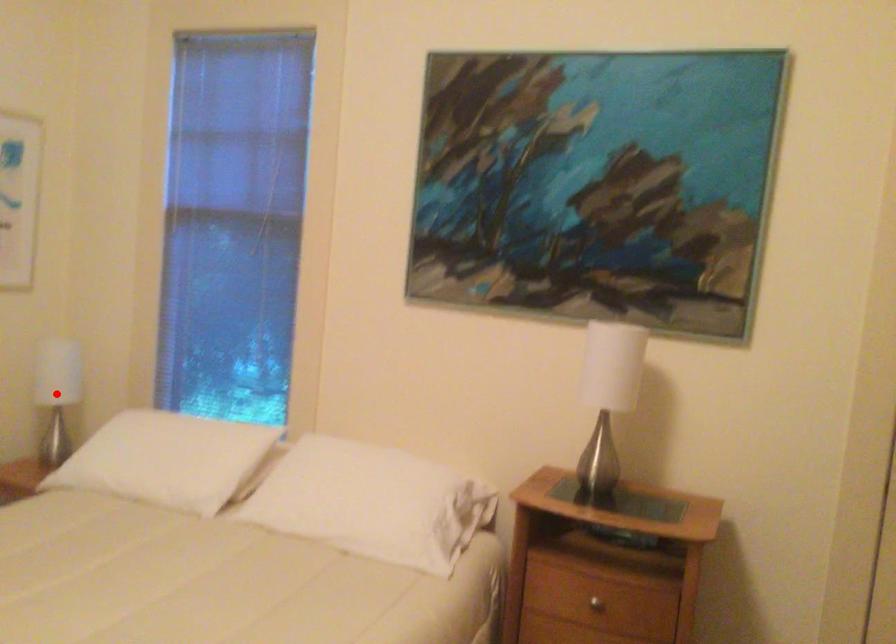
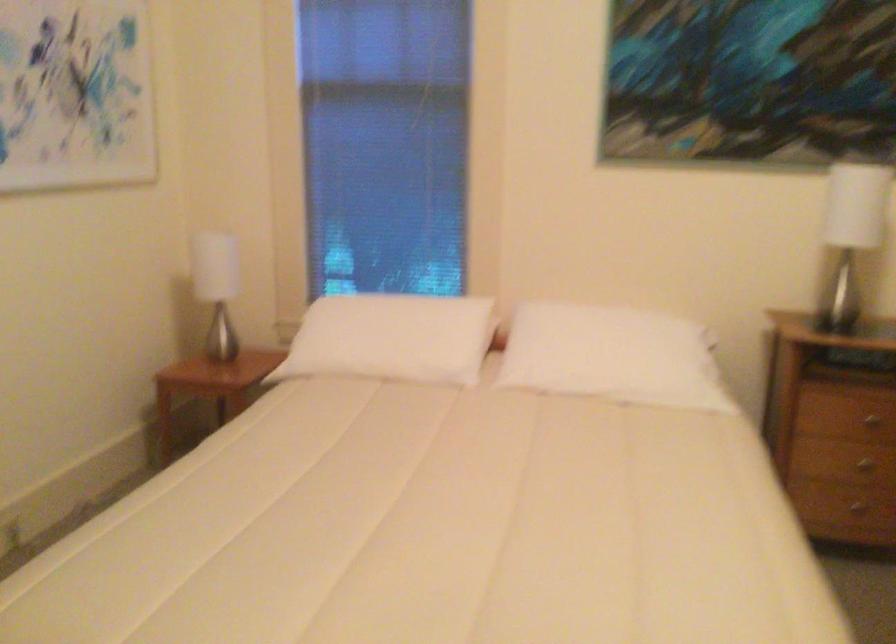
Question: I am providing you with two images of the same scene from different viewpoints. A red point is marked on the first image. Is the red point's position out of view in image 2?

Choices:
 (A) Yes
 (B) No

Answer: (A)